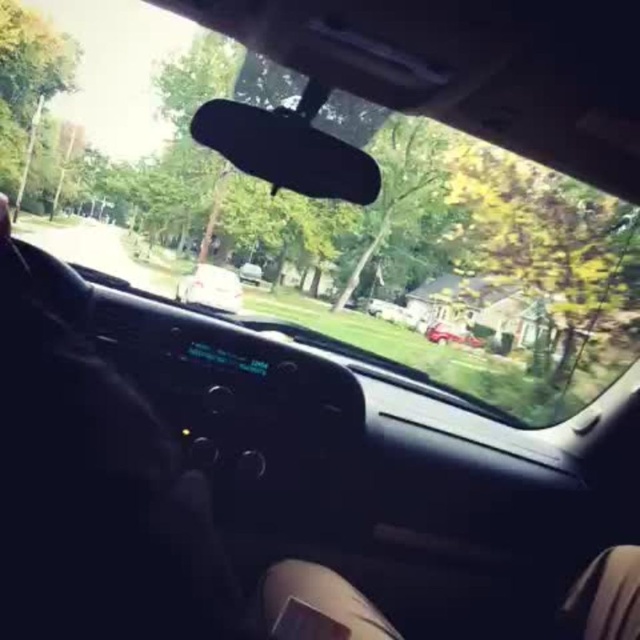
Question: Which point is closer to the camera?

Choices:
 (A) skinny jeans at lower center
 (B) white glossy sedan at center
 (C) transparent glass car window at center

Answer: (A)

Question: Based on their relative distances, which object is farther from the transparent glass car window at center?

Choices:
 (A) skinny jeans at lower center
 (B) white glossy sedan at center

Answer: (A)

Question: Which point is closer to the camera?

Choices:
 (A) white glossy sedan at center
 (B) transparent glass car window at center

Answer: (B)

Question: Does skinny jeans at lower center appear under metallic silver car at center?

Choices:
 (A) yes
 (B) no

Answer: (A)

Question: Can you confirm if transparent glass car window at center is thinner than metallic silver car at center?

Choices:
 (A) yes
 (B) no

Answer: (B)

Question: Is transparent glass car window at center below metallic silver car at center?

Choices:
 (A) no
 (B) yes

Answer: (A)